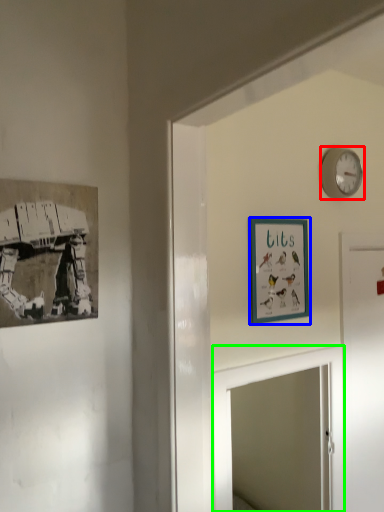
Question: Considering the real-world distances, which object is farthest from wall clock (highlighted by a red box)? picture frame (highlighted by a blue box) or mirror (highlighted by a green box)?

Choices:
 (A) picture frame
 (B) mirror

Answer: (B)